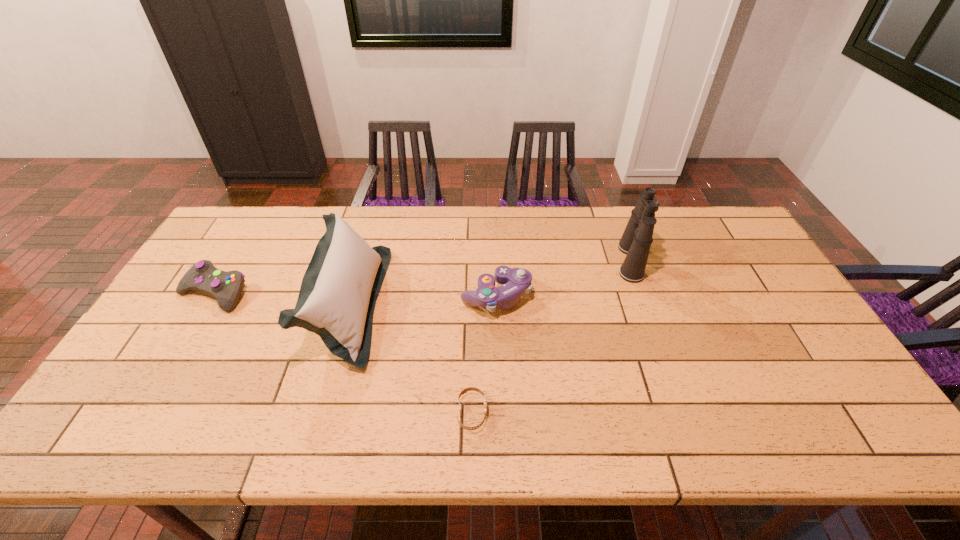
Locate an element on the screen. The height and width of the screenshot is (540, 960). free region at the left edge of the desktop is located at coordinates (178, 308).

In the image, there is a desktop. In order to click on free space at the right edge in this screenshot , I will do `click(773, 333)`.

Where is `free spot between the shorter control and the rightmost object`? This screenshot has height=540, width=960. free spot between the shorter control and the rightmost object is located at coordinates (422, 277).

You are a GUI agent. You are given a task and a screenshot of the screen. Output one action in this format:
    pyautogui.click(x=<x>, y=<y>)
    Task: Click on the free space between the shortest object and the fourth shortest object
    
    Given the screenshot: What is the action you would take?
    pyautogui.click(x=411, y=359)

This screenshot has height=540, width=960. What are the coordinates of `empty location between the tallest object and the watch` in the screenshot? It's located at (551, 337).

Identify the location of free point between the tallest object and the left control. (422, 277).

Where is `free space between the right control and the cushion`? Image resolution: width=960 pixels, height=540 pixels. free space between the right control and the cushion is located at coordinates coord(422,300).

Locate an element on the screen. This screenshot has width=960, height=540. vacant space that is in between the left control and the fourth object from right to left is located at coordinates (281, 299).

The height and width of the screenshot is (540, 960). Find the location of `free space between the third tallest object and the rightmost object`. free space between the third tallest object and the rightmost object is located at coordinates (564, 279).

Where is `free space between the leftmost object and the fourth object from right to left`? free space between the leftmost object and the fourth object from right to left is located at coordinates (281, 299).